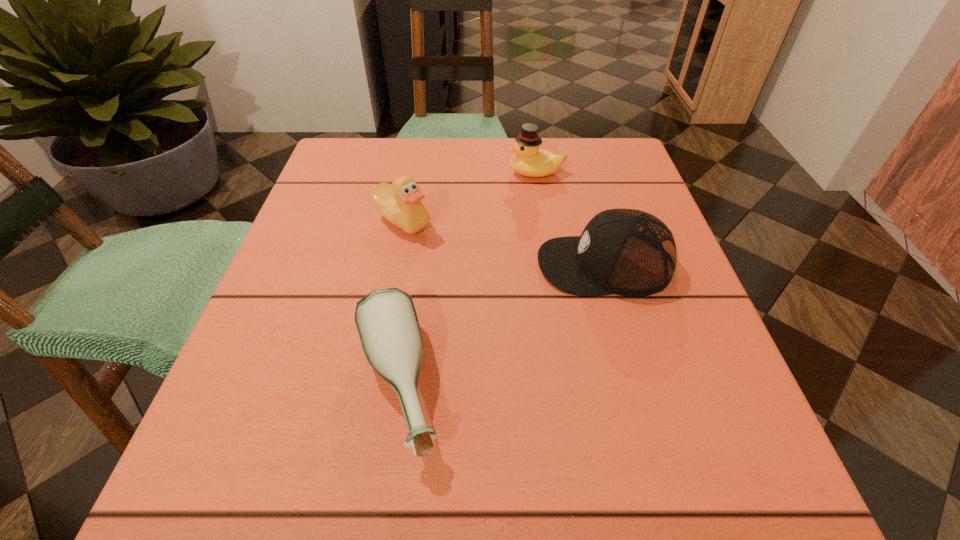
At what (x,y) coordinates should I click in order to perform the action: click on vacant area located 0.320m on the front-facing side of the cap. Please return your answer as a coordinate pair (x, y). Looking at the image, I should click on (357, 265).

Find the location of a particular element. The height and width of the screenshot is (540, 960). vacant space located 0.120m on the front-facing side of the cap is located at coordinates (469, 265).

The height and width of the screenshot is (540, 960). Find the location of `vacant position located on the front-facing side of the cap`. vacant position located on the front-facing side of the cap is located at coordinates (391, 265).

Where is `vacant region located 0.100m on the left of the bottle`? vacant region located 0.100m on the left of the bottle is located at coordinates (276, 386).

This screenshot has height=540, width=960. What are the coordinates of `object that is at the far edge` in the screenshot? It's located at (529, 160).

Locate an element on the screen. The height and width of the screenshot is (540, 960). object situated at the near edge is located at coordinates (386, 321).

This screenshot has height=540, width=960. Identify the location of object that is at the left edge. (400, 203).

Locate an element on the screen. object located in the right edge section of the desktop is located at coordinates (627, 252).

Locate an element on the screen. The image size is (960, 540). vacant space at the far edge of the desktop is located at coordinates (464, 170).

Locate an element on the screen. The height and width of the screenshot is (540, 960). free space at the near edge of the desktop is located at coordinates (442, 447).